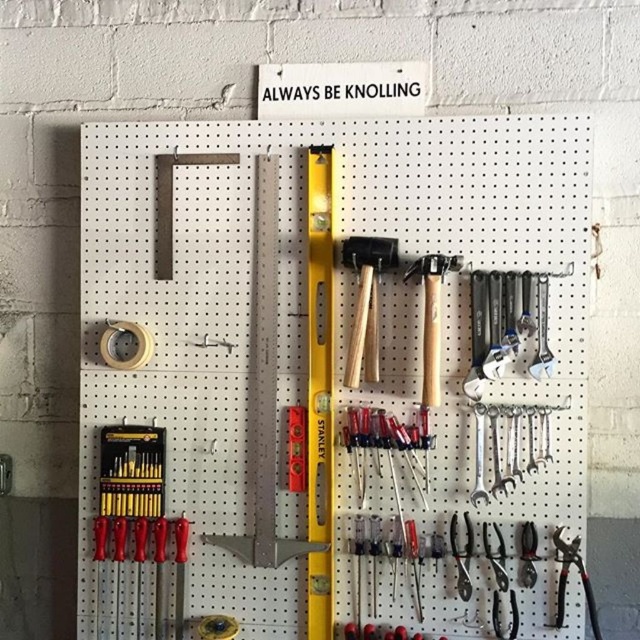
Question: Which point is farther to the camera?

Choices:
 (A) matte black screwdriver set at lower left
 (B) polished chrome wrenches at center right

Answer: (A)

Question: Does white pegboard at center appear under matte black screwdriver set at lower left?

Choices:
 (A) no
 (B) yes

Answer: (A)

Question: Does white pegboard at center have a smaller size compared to wooden mallets at center?

Choices:
 (A) no
 (B) yes

Answer: (A)

Question: Does matte black screwdriver set at lower left have a smaller size compared to polished chrome wrenches at center right?

Choices:
 (A) no
 (B) yes

Answer: (A)

Question: Which object is farther from the camera taking this photo?

Choices:
 (A) wooden mallets at center
 (B) matte black screwdriver set at lower left
 (C) white pegboard at center

Answer: (B)

Question: Which of the following is the closest to the observer?

Choices:
 (A) (342, 250)
 (B) (323, 269)
 (C) (506, 456)
 (D) (138, 600)

Answer: (C)